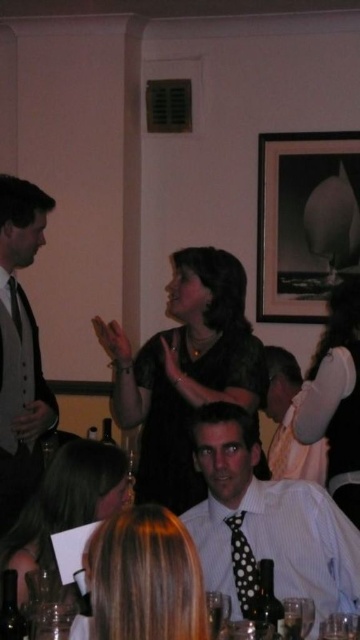
You are a photographer at a formal event. You want to take a photo of both the white striped shirt at center and the white satin dress at center. The camera you are using has a lens that can focus on objects within a 20 inch range. Can both subjects be in focus in the same photo?

The white striped shirt at center and white satin dress at center are 22.88 inches apart, which exceeds the camera lens focus range of 20 inches. Therefore, both subjects cannot be in focus simultaneously in the same photo.

You are a photographer at a formal event. You want to take a photo of the smooth black dress at center and the black dotted tie at left so that both are clearly visible. Given that your camera has a maximum focus range of 35 inches, will you be able to capture both objects in focus without moving closer?

The smooth black dress at center and the black dotted tie at left are 38.61 inches apart. Since the distance between them exceeds the camera maximum focus range of 35 inches, you will not be able to capture both in focus without moving closer.

You are a photographer at the event and want to capture a photo that includes both the white striped shirt at center and the white satin dress at center. Which one should you focus on first to ensure it appears in the foreground?

The white striped shirt at center is positioned under the white satin dress at center, so focusing on the white satin dress at center first will place it in the foreground.